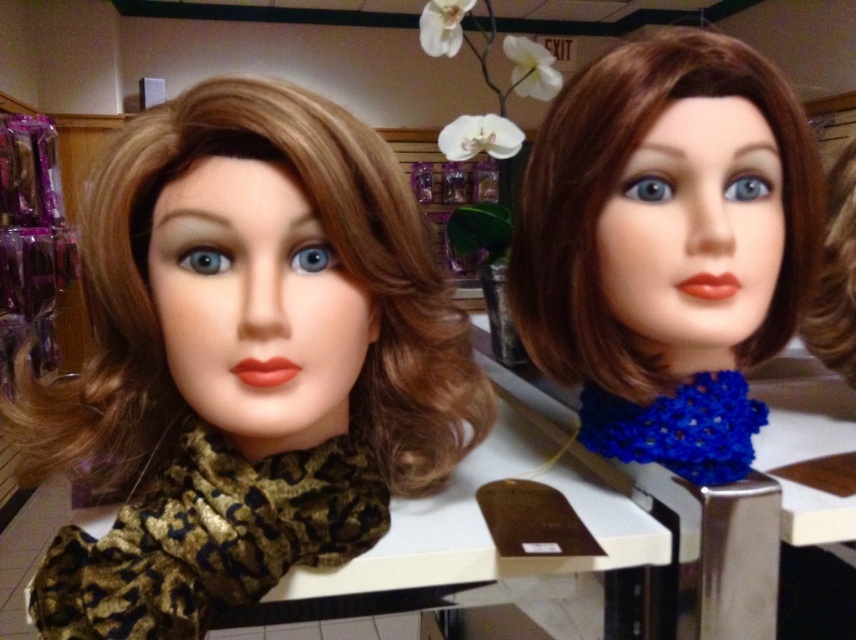
Question: Among these points, which one is farthest from the camera?

Choices:
 (A) (830, 362)
 (B) (584, 305)
 (C) (126, 412)

Answer: (A)

Question: Can you confirm if metallic silver table at center is positioned below brown silky hair at upper right?

Choices:
 (A) yes
 (B) no

Answer: (A)

Question: Is brownleather-likewig at left below brown silky hair at upper right?

Choices:
 (A) yes
 (B) no

Answer: (A)

Question: Which point is closer to the camera taking this photo?

Choices:
 (A) (54, 420)
 (B) (811, 600)
 (C) (813, 355)

Answer: (A)

Question: Which point is closer to the camera taking this photo?

Choices:
 (A) (391, 481)
 (B) (782, 154)

Answer: (B)

Question: Can you confirm if brown matte wig at upper right is bigger than brown silky hair at upper right?

Choices:
 (A) yes
 (B) no

Answer: (A)